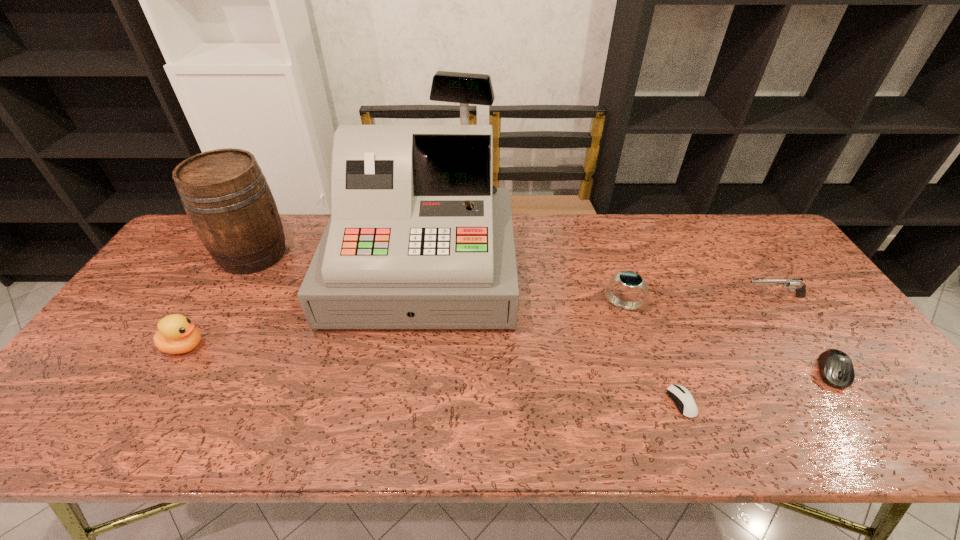
At what (x,y) coordinates should I click in order to perform the action: click on the fifth object from right to left. Please return your answer as a coordinate pair (x, y). Looking at the image, I should click on (419, 237).

Image resolution: width=960 pixels, height=540 pixels. I want to click on the tallest object, so click(419, 237).

The height and width of the screenshot is (540, 960). I want to click on cider, so click(228, 201).

The image size is (960, 540). What are the coordinates of `duckling` in the screenshot? It's located at (177, 334).

Locate an element on the screen. watch is located at coordinates (629, 280).

Identify the location of the third shortest object. The width and height of the screenshot is (960, 540). (797, 285).

You are a GUI agent. You are given a task and a screenshot of the screen. Output one action in this format:
    pyautogui.click(x=<x>, y=<y>)
    Task: Click on the right mouse
    This screenshot has height=540, width=960.
    Given the screenshot: What is the action you would take?
    coord(836,369)

The width and height of the screenshot is (960, 540). I want to click on the second shortest object, so click(x=836, y=369).

Identify the location of the shorter mouse. (683, 399).

Image resolution: width=960 pixels, height=540 pixels. Identify the location of the left mouse. (683, 399).